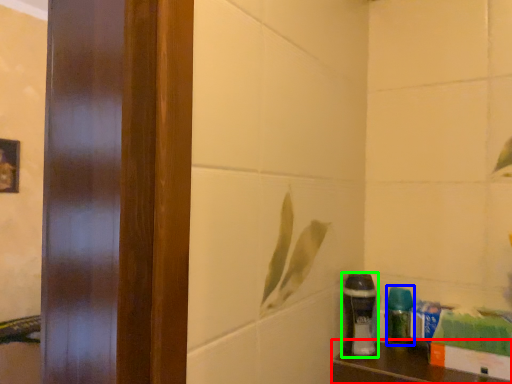
Question: Which is nearer to the furniture (highlighted by a red box)? cleaning product (highlighted by a blue box) or shaving cream (highlighted by a green box).

Choices:
 (A) cleaning product
 (B) shaving cream

Answer: (A)